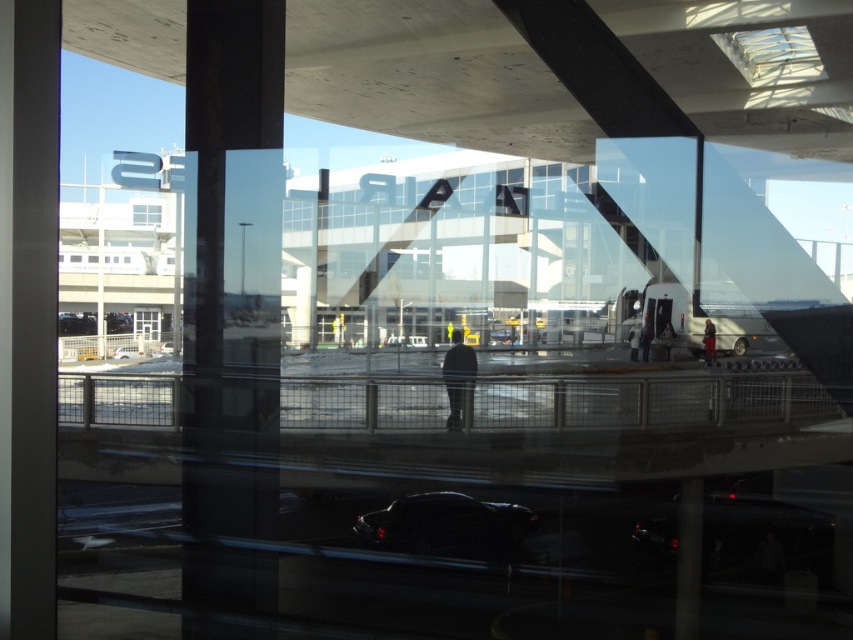
Question: Which object is positioned farthest from the transparent glass window at center?

Choices:
 (A) shiny black car at center
 (B) transparent glass window at upper center

Answer: (A)

Question: Does black glass pillar at center have a smaller size compared to clear glass window at center?

Choices:
 (A) no
 (B) yes

Answer: (B)

Question: Which point is farther to the camera?

Choices:
 (A) (792, 550)
 (B) (212, 51)
 (C) (137, 310)

Answer: (C)

Question: Which object is closer to the camera taking this photo?

Choices:
 (A) transparent glass window at center
 (B) black glossy car at lower right
 (C) transparent glass window at upper center
 (D) black glass pillar at center

Answer: (D)

Question: Is black glass pillar at center smaller than shiny black car at center?

Choices:
 (A) no
 (B) yes

Answer: (B)

Question: Does shiny black car at center appear on the left side of transparent glass window at upper center?

Choices:
 (A) yes
 (B) no

Answer: (B)